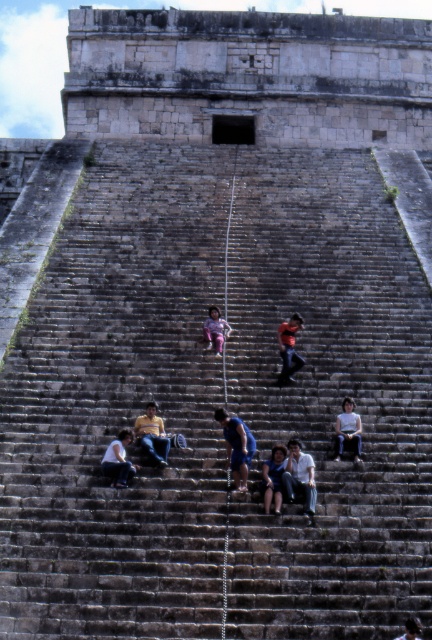
You are a tour guide explaining the historical site to visitors. You notice two items on the historic stone staircase. Which one is bigger between the blue denim shorts at center and the light blue jeans at center?

The blue denim shorts at center is larger in size than the light blue jeans at center.

You are standing at the bottom of the historic stone staircase and see the blue denim shorts at center and the pink fabric pants at center. Which one is closer to you?

The blue denim shorts at center is closer to you because it is in front of the pink fabric pants at center.